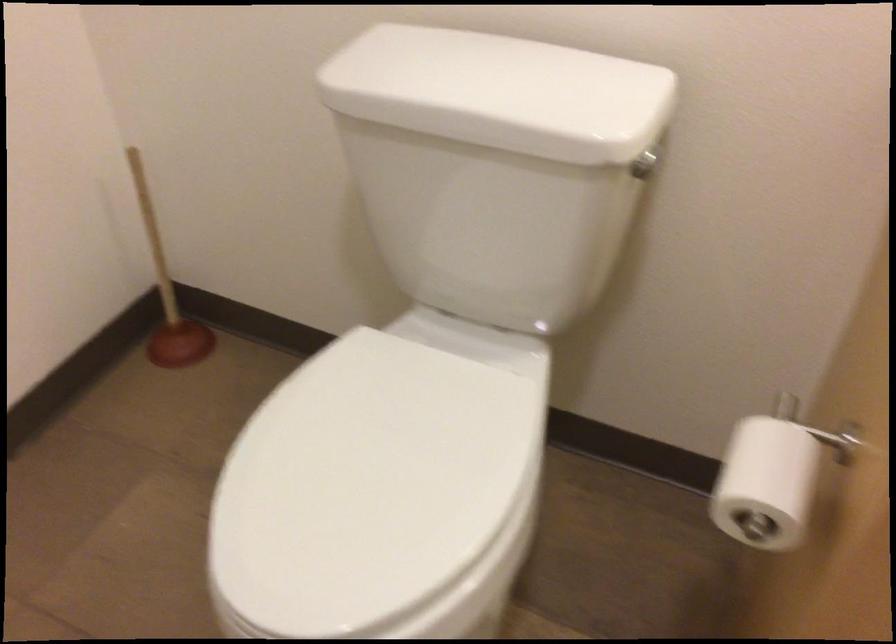
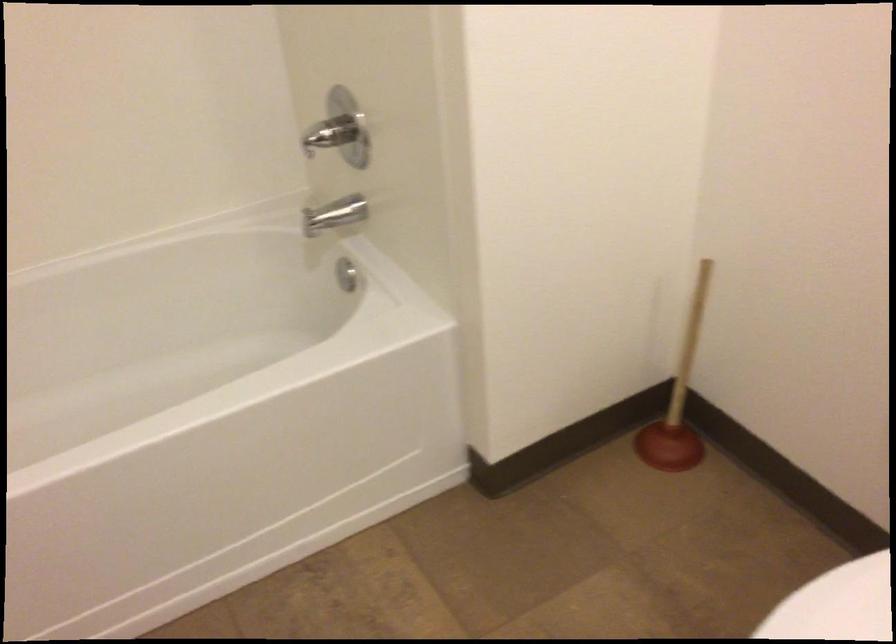
Question: The camera is either moving clockwise (left) or counter-clockwise (right) around the object. The first image is from the beginning of the video and the second image is from the end. Is the camera moving left or right when shooting the video?

Choices:
 (A) Left
 (B) Right

Answer: (B)